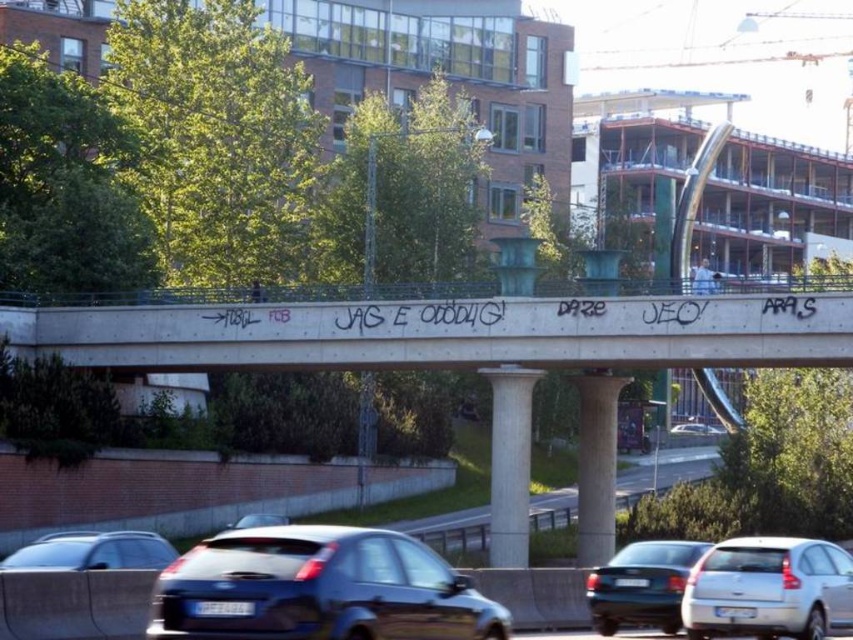
Which of these two, metallic blue hatchback at lower center or matte black car at lower center, stands shorter?

matte black car at lower center

Does point (450, 628) come farther from viewer compared to point (616, 579)?

No.

I want to click on metallic blue hatchback at lower center, so click(318, 588).

Is point (164, 540) in front of point (235, 524)?

Yes, it is in front of point (235, 524).

Is point (85, 561) positioned behind point (260, 515)?

No, it is not.

Where is `metallic silver car at lower left`? The height and width of the screenshot is (640, 853). metallic silver car at lower left is located at coordinates (91, 552).

This screenshot has height=640, width=853. I want to click on metallic silver car at lower left, so click(91, 552).

Is metallic blue hatchback at lower center thinner than green asphalt highway at center?

Yes.

Does metallic blue hatchback at lower center have a greater width compared to green asphalt highway at center?

In fact, metallic blue hatchback at lower center might be narrower than green asphalt highway at center.

Does point (383, 636) come in front of point (531, 528)?

Yes, it is.

Where is `metallic blue hatchback at lower center`? Image resolution: width=853 pixels, height=640 pixels. metallic blue hatchback at lower center is located at coordinates (318, 588).